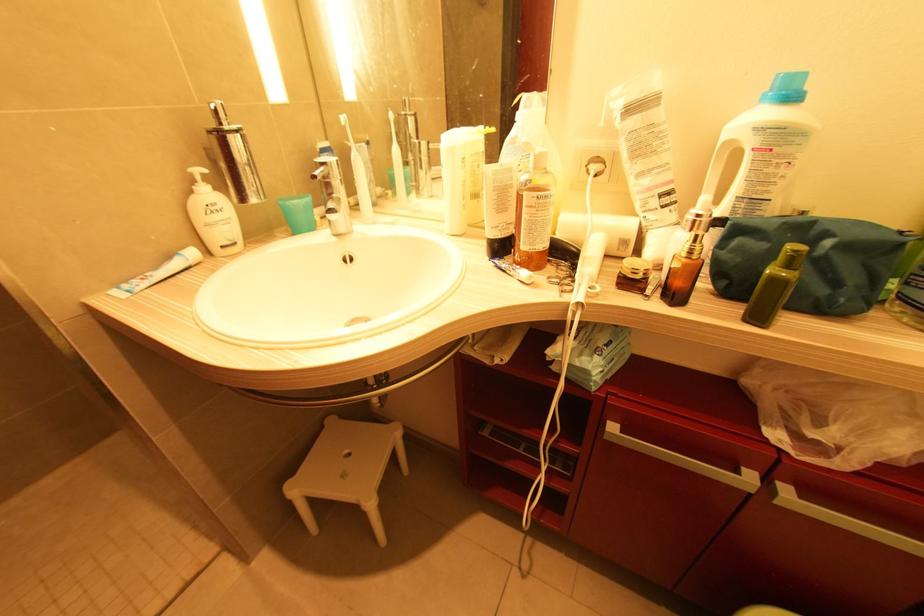
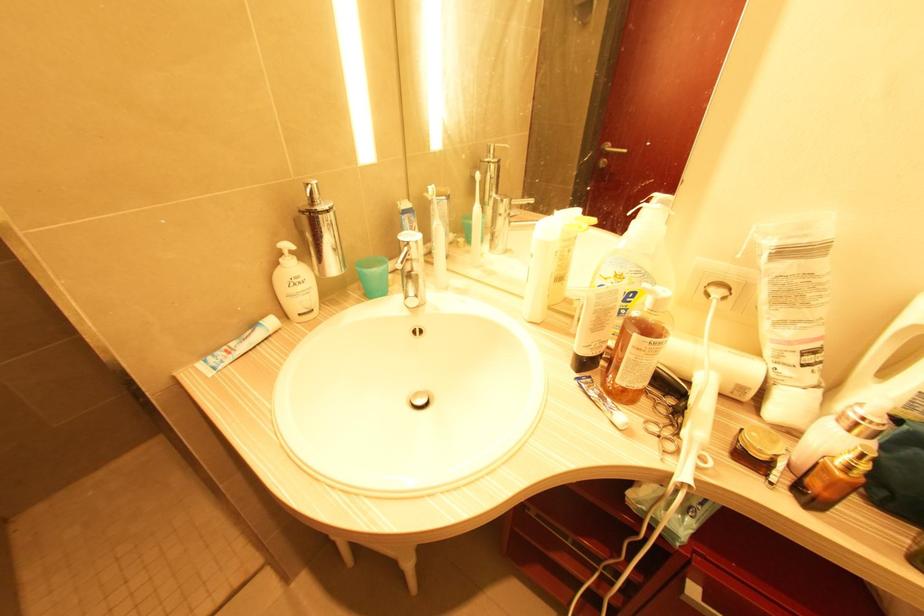
In the second image, find the point that corresponds to point 690,254 in the first image.

(850, 468)